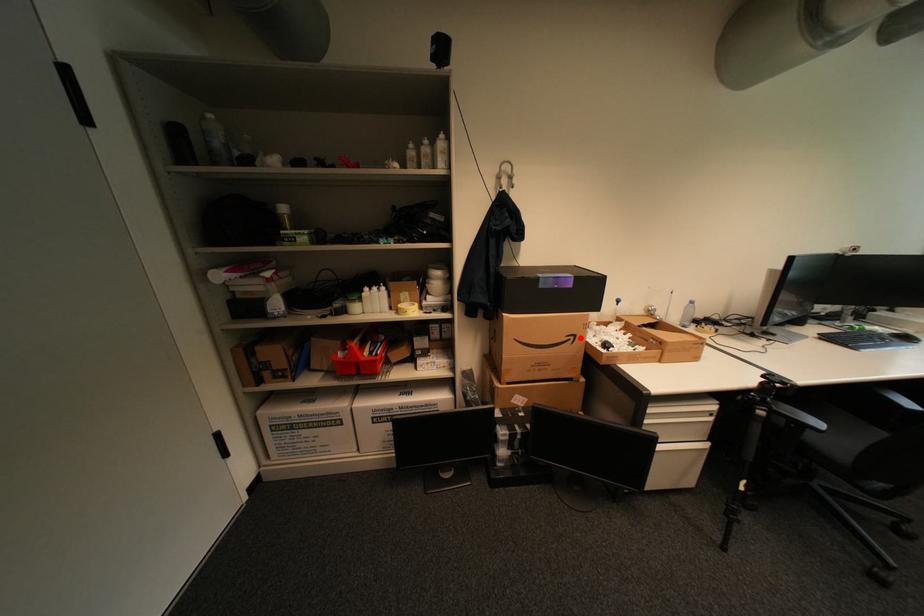
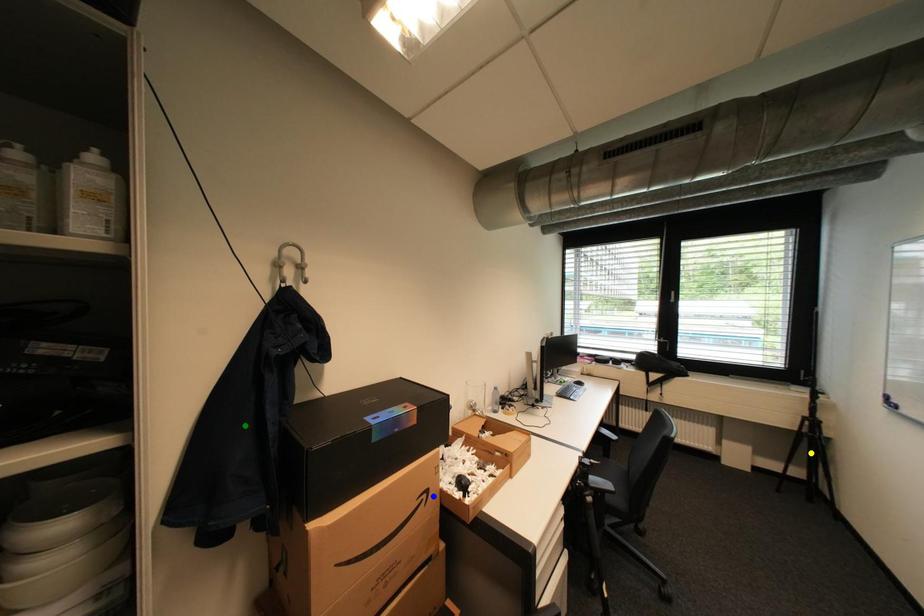
Question: I am providing you with two images of the same scene from different viewpoints. A red point is marked on the first image. You are given multiple points on the second image. Can you choose the point in image 2 that corresponds to the point in image 1?

Choices:
 (A) blue point
 (B) green point
 (C) yellow point

Answer: (A)